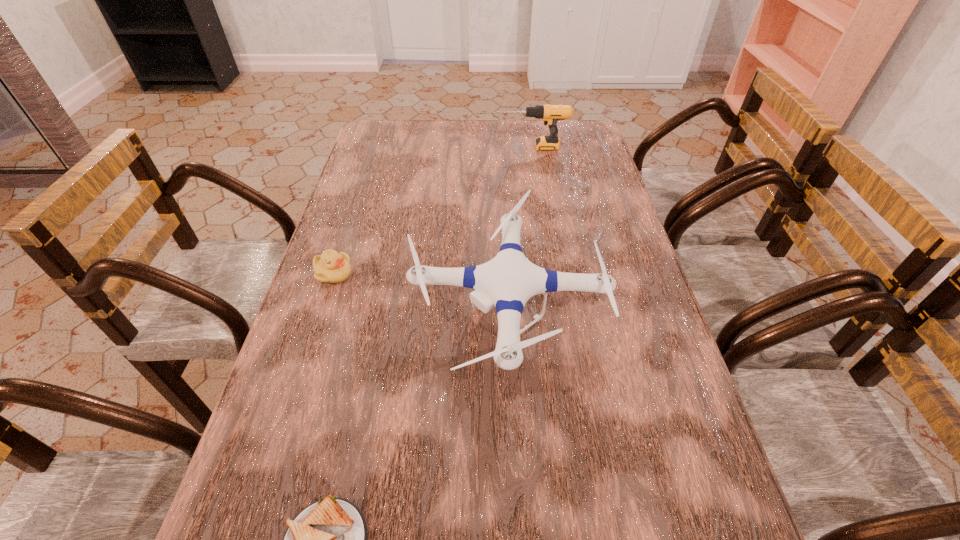
This screenshot has width=960, height=540. What are the coordinates of `drill` in the screenshot? It's located at (550, 114).

This screenshot has height=540, width=960. Identify the location of drone. (509, 280).

Locate an element on the screen. The image size is (960, 540). the second shortest object is located at coordinates (331, 267).

Find the location of a particular element. The width and height of the screenshot is (960, 540). the leftmost object is located at coordinates (331, 267).

Find the location of a particular element. free space located 0.190m on the handle side of the farthest object is located at coordinates (439, 147).

At what (x,y) coordinates should I click in order to perform the action: click on vacant space located on the handle side of the farthest object. Please return your answer as a coordinate pair (x, y). The image size is (960, 540). Looking at the image, I should click on (436, 147).

I want to click on vacant space located 0.100m on the handle side of the farthest object, so click(465, 147).

At what (x,y) coordinates should I click in order to perform the action: click on vacant space located on the back of the drone. Please return your answer as a coordinate pair (x, y). Image resolution: width=960 pixels, height=540 pixels. Looking at the image, I should click on pos(498,161).

Identify the location of vacant space situated 0.300m on the beak of the duckling. The height and width of the screenshot is (540, 960). (472, 274).

At what (x,y) coordinates should I click in order to perform the action: click on object present at the far edge. Please return your answer as a coordinate pair (x, y). The height and width of the screenshot is (540, 960). Looking at the image, I should click on pos(550,114).